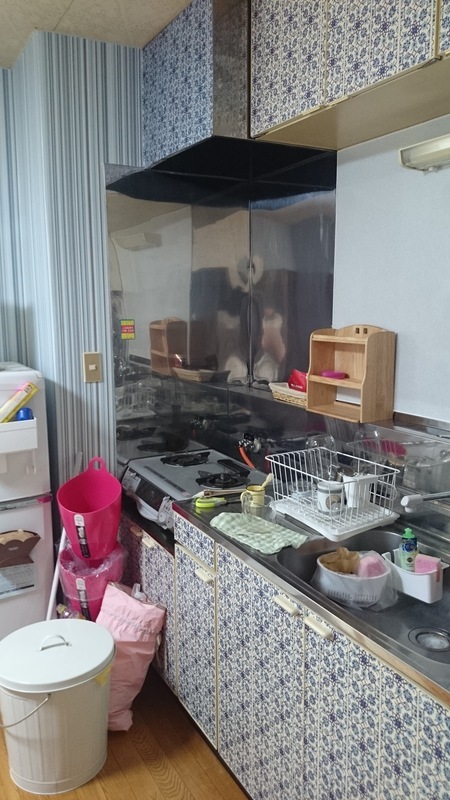
This screenshot has width=450, height=800. Find the location of `pink bucket`. pink bucket is located at coordinates (90, 530), (92, 598).